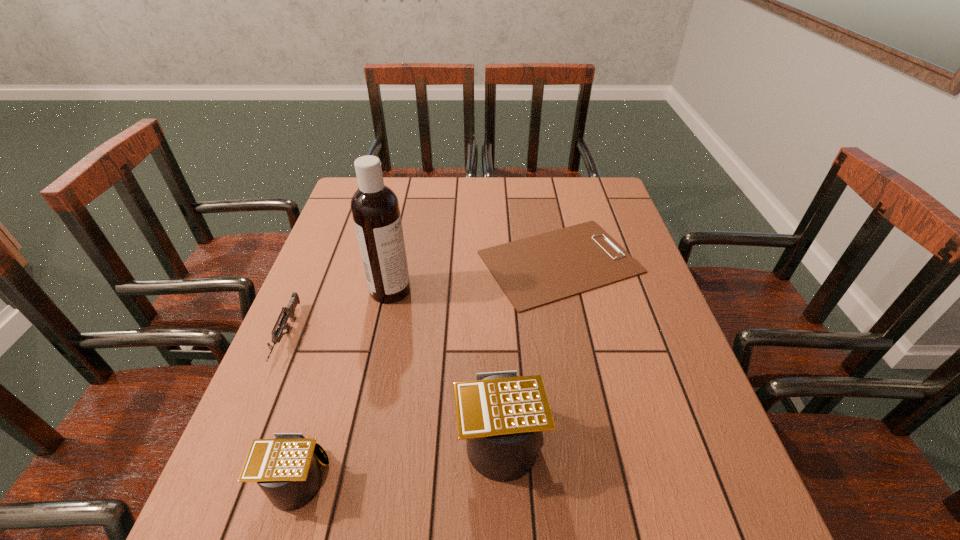
Locate an element on the screen. the left calculator is located at coordinates (285, 468).

Image resolution: width=960 pixels, height=540 pixels. Find the location of `the shorter calculator`. the shorter calculator is located at coordinates (285, 468).

Locate an element on the screen. This screenshot has height=540, width=960. the right calculator is located at coordinates (501, 415).

Identify the location of the taller calculator. (501, 415).

Identify the location of dishwasher detergent. (375, 209).

Locate an element on the screen. The width and height of the screenshot is (960, 540). the second shortest object is located at coordinates (288, 312).

What are the coordinates of `the leftmost object` in the screenshot? It's located at (288, 312).

Locate an element on the screen. the shortest object is located at coordinates (538, 270).

Locate an element on the screen. free space located on the back of the third tallest object is located at coordinates (329, 371).

Find the location of a particular element. The width and height of the screenshot is (960, 540). vacant space located on the left of the right calculator is located at coordinates (372, 436).